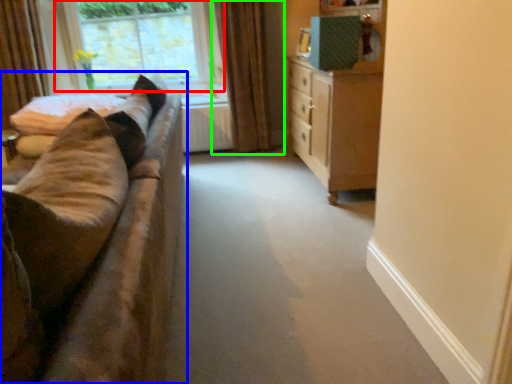
Question: Which object is positioned closest to window (highlighted by a red box)? Select from studio couch (highlighted by a blue box) and curtain (highlighted by a green box).

Choices:
 (A) studio couch
 (B) curtain

Answer: (B)